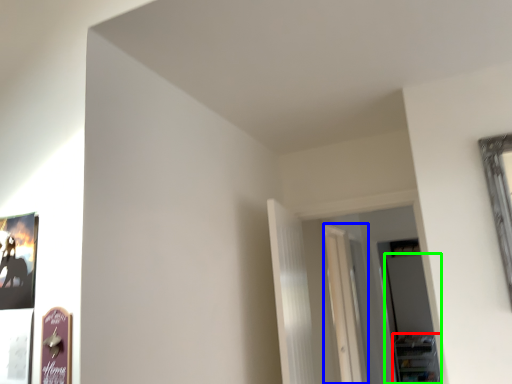
Question: Considering the real-world distances, which object is closest to shelf (highlighted by a red box)? glass door (highlighted by a blue box) or glass door (highlighted by a green box).

Choices:
 (A) glass door
 (B) glass door

Answer: (B)